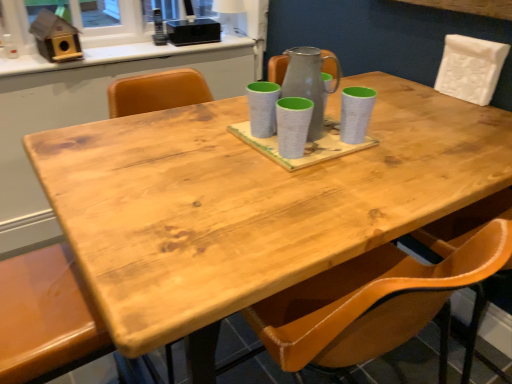
Question: From the image's perspective, does white matte chair at upper right, the 1th chair from the top, appear lower than white glossy counter top at upper center?

Choices:
 (A) yes
 (B) no

Answer: (A)

Question: Considering the relative sizes of white matte chair at upper right, acting as the 2th chair starting from the bottom, and white glossy counter top at upper center in the image provided, is white matte chair at upper right, acting as the 2th chair starting from the bottom, shorter than white glossy counter top at upper center?

Choices:
 (A) yes
 (B) no

Answer: (B)

Question: Is white matte chair at upper right, acting as the 2th chair starting from the bottom, to the right of white glossy counter top at upper center from the viewer's perspective?

Choices:
 (A) yes
 (B) no

Answer: (A)

Question: Considering the relative positions of white matte chair at upper right, the 1th chair from the top, and white glossy counter top at upper center in the image provided, is white matte chair at upper right, the 1th chair from the top, to the left of white glossy counter top at upper center from the viewer's perspective?

Choices:
 (A) yes
 (B) no

Answer: (B)

Question: Is there a large distance between white matte chair at upper right, acting as the 2th chair starting from the bottom, and white glossy counter top at upper center?

Choices:
 (A) no
 (B) yes

Answer: (B)

Question: Is speckled white mug at center, the second mug viewed from the left, in front of or behind white glossy counter top at upper center in the image?

Choices:
 (A) front
 (B) behind

Answer: (A)

Question: Does point (294, 152) appear closer or farther from the camera than point (225, 44)?

Choices:
 (A) farther
 (B) closer

Answer: (B)

Question: In terms of size, does speckled white mug at center, the 2th mug viewed from the right, appear bigger or smaller than white glossy counter top at upper center?

Choices:
 (A) big
 (B) small

Answer: (B)

Question: From a real-world perspective, is speckled white mug at center, the 2th mug viewed from the right, positioned above or below white glossy counter top at upper center?

Choices:
 (A) above
 (B) below

Answer: (A)

Question: Visually, is matte gray pitcher at center positioned to the left or to the right of speckled white mug at center, the 2th mug viewed from the right?

Choices:
 (A) left
 (B) right

Answer: (B)

Question: In terms of width, does matte gray pitcher at center look wider or thinner when compared to speckled white mug at center, the second mug viewed from the left?

Choices:
 (A) wide
 (B) thin

Answer: (A)

Question: Is matte gray pitcher at center inside the boundaries of speckled white mug at center, the 2th mug viewed from the right, or outside?

Choices:
 (A) inside
 (B) outside

Answer: (B)

Question: Does point (287, 51) appear closer or farther from the camera than point (304, 119)?

Choices:
 (A) closer
 (B) farther

Answer: (B)

Question: From the image's perspective, is white matte chair at upper right, acting as the 2th chair starting from the bottom, positioned above or below matte brown chair at lower left, the 1th chair when ordered from left to right?

Choices:
 (A) below
 (B) above

Answer: (B)

Question: Does point (453, 66) appear closer or farther from the camera than point (24, 269)?

Choices:
 (A) closer
 (B) farther

Answer: (B)